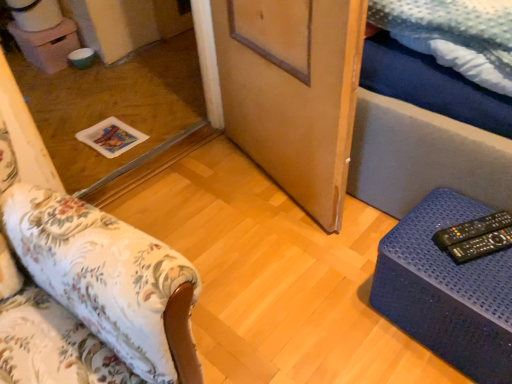
Question: Is floral fabric ottoman at lower left, the 2th furniture in the right-to-left sequence, touching wooden door at center?

Choices:
 (A) yes
 (B) no

Answer: (B)

Question: Considering the relative positions of floral fabric ottoman at lower left, the 2th furniture in the right-to-left sequence, and wooden door at center in the image provided, is floral fabric ottoman at lower left, the 2th furniture in the right-to-left sequence, to the right of wooden door at center from the viewer's perspective?

Choices:
 (A) yes
 (B) no

Answer: (B)

Question: Is floral fabric ottoman at lower left, the 2th furniture in the right-to-left sequence, further to the viewer compared to wooden door at center?

Choices:
 (A) no
 (B) yes

Answer: (A)

Question: From the image's perspective, is floral fabric ottoman at lower left, the 2th furniture in the right-to-left sequence, on wooden door at center?

Choices:
 (A) no
 (B) yes

Answer: (A)

Question: Is floral fabric ottoman at lower left, which is counted as the first furniture, starting from the left, outside wooden door at center?

Choices:
 (A) yes
 (B) no

Answer: (A)

Question: Looking at their shapes, would you say black plastic remote at lower right, the second remote in the front-to-back sequence, is wider or thinner than black plastic remote at lower right, which is the 1th remote in front-to-back order?

Choices:
 (A) thin
 (B) wide

Answer: (B)

Question: Is point (510, 218) positioned closer to the camera than point (468, 243)?

Choices:
 (A) closer
 (B) farther

Answer: (B)

Question: In the image, is black plastic remote at lower right, which is counted as the 1th remote, starting from the back, positioned in front of or behind black plastic remote at lower right, the 2th remote viewed from the back?

Choices:
 (A) behind
 (B) front

Answer: (A)

Question: From a real-world perspective, relative to black plastic remote at lower right, which is the 1th remote in front-to-back order, is black plastic remote at lower right, which is counted as the 1th remote, starting from the back, vertically above or below?

Choices:
 (A) below
 (B) above

Answer: (B)

Question: Is floral fabric ottoman at lower left, which is counted as the first furniture, starting from the left, situated inside black plastic remote at lower right, which is counted as the 1th remote, starting from the back, or outside?

Choices:
 (A) outside
 (B) inside

Answer: (A)

Question: Considering the positions of floral fabric ottoman at lower left, the 2th furniture in the right-to-left sequence, and black plastic remote at lower right, the second remote in the front-to-back sequence, in the image, is floral fabric ottoman at lower left, the 2th furniture in the right-to-left sequence, taller or shorter than black plastic remote at lower right, the second remote in the front-to-back sequence,?

Choices:
 (A) tall
 (B) short

Answer: (A)

Question: Relative to black plastic remote at lower right, which is counted as the 1th remote, starting from the back, is floral fabric ottoman at lower left, the 2th furniture in the right-to-left sequence, in front or behind?

Choices:
 (A) front
 (B) behind

Answer: (A)

Question: Is point (125, 248) positioned closer to the camera than point (434, 235)?

Choices:
 (A) closer
 (B) farther

Answer: (A)

Question: Is transparent glass door at center taller or shorter than blue textured ottoman at lower right, the first furniture in the right-to-left sequence?

Choices:
 (A) tall
 (B) short

Answer: (B)

Question: From a real-world perspective, is transparent glass door at center positioned above or below blue textured ottoman at lower right, which is counted as the second furniture, starting from the left?

Choices:
 (A) above
 (B) below

Answer: (B)